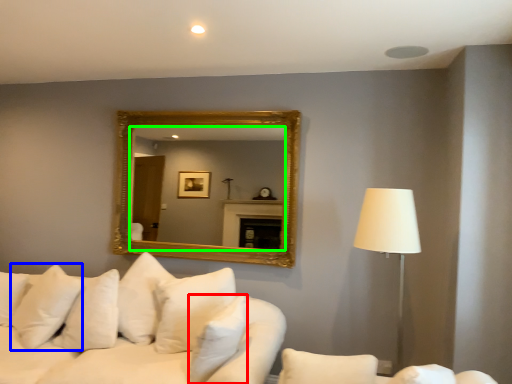
Question: Considering the real-world distances, which object is farthest from pillow (highlighted by a red box)? pillow (highlighted by a blue box) or mirror (highlighted by a green box)?

Choices:
 (A) pillow
 (B) mirror

Answer: (B)